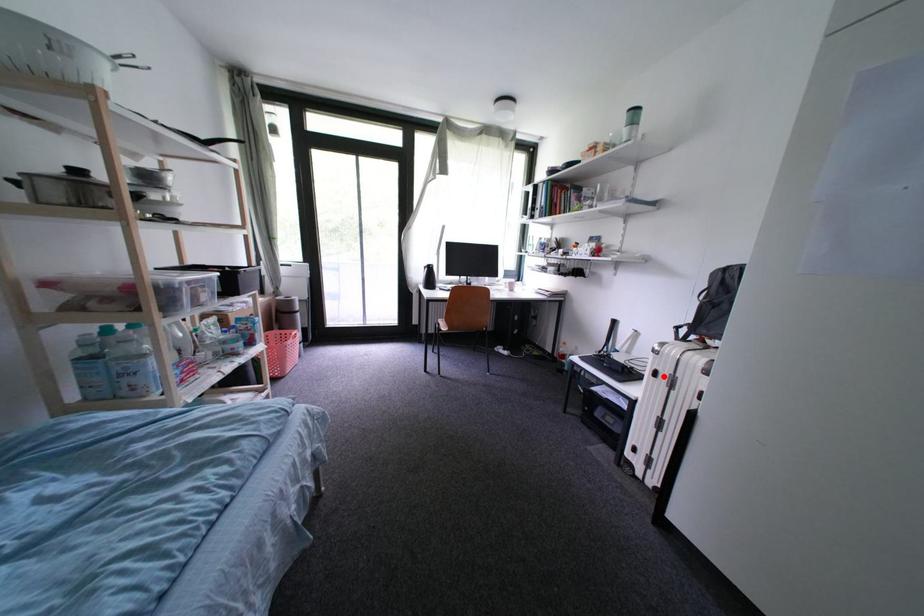
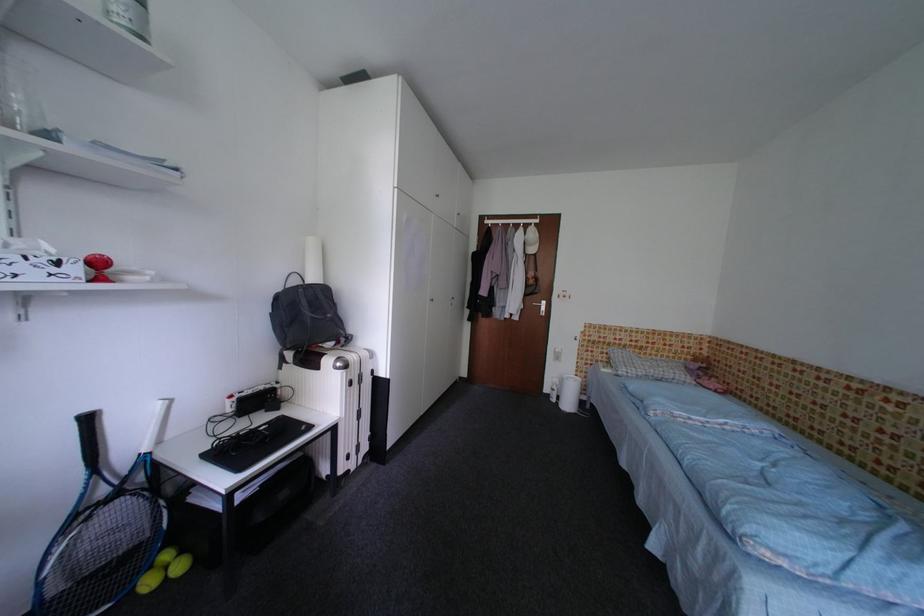
Question: I am providing you with two images of the same scene from different viewpoints. Image1 has a red point marked. In image2, the corresponding 3D location appears at what relative position? Reply with the corresponding letter.

Choices:
 (A) Closer
 (B) Farther

Answer: (B)